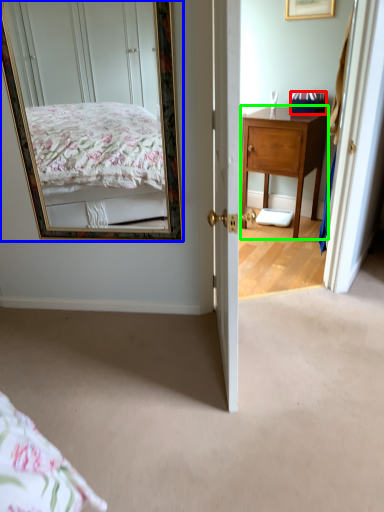
Question: Which object is positioned farthest from box (highlighted by a red box)? Select from mirror (highlighted by a blue box) and desk (highlighted by a green box).

Choices:
 (A) mirror
 (B) desk

Answer: (A)